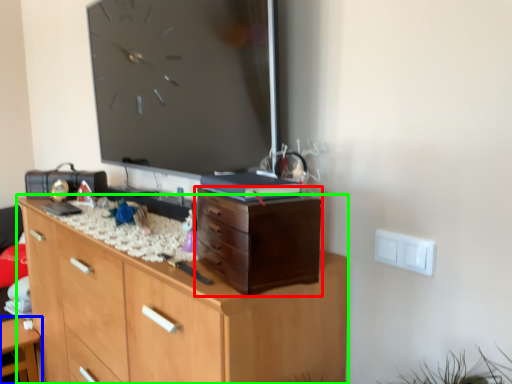
Question: Considering the real-world distances, which object is closest to chest of drawers (highlighted by a red box)? table (highlighted by a blue box) or chest of drawers (highlighted by a green box).

Choices:
 (A) table
 (B) chest of drawers

Answer: (B)